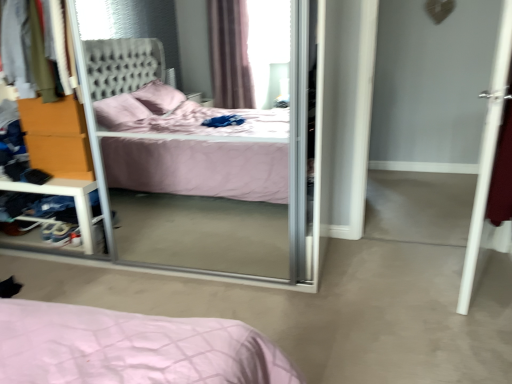
Question: Considering the relative positions of orange wood dresser at left and transparent glass screen door at center in the image provided, is orange wood dresser at left to the left or to the right of transparent glass screen door at center?

Choices:
 (A) left
 (B) right

Answer: (A)

Question: In the image, is orange wood dresser at left positioned in front of or behind transparent glass screen door at center?

Choices:
 (A) front
 (B) behind

Answer: (B)

Question: Based on their relative distances, which object is nearer to the velvet fabric sweater at upper left?

Choices:
 (A) transparent glass screen door at center
 (B) white smooth door at right
 (C) orange wood dresser at left
 (D) clear plastic shelf at left

Answer: (C)

Question: Considering the real-world distances, which object is closest to the orange wood dresser at left?

Choices:
 (A) white smooth door at right
 (B) clear plastic shelf at left
 (C) velvet fabric sweater at upper left
 (D) transparent glass screen door at center

Answer: (B)